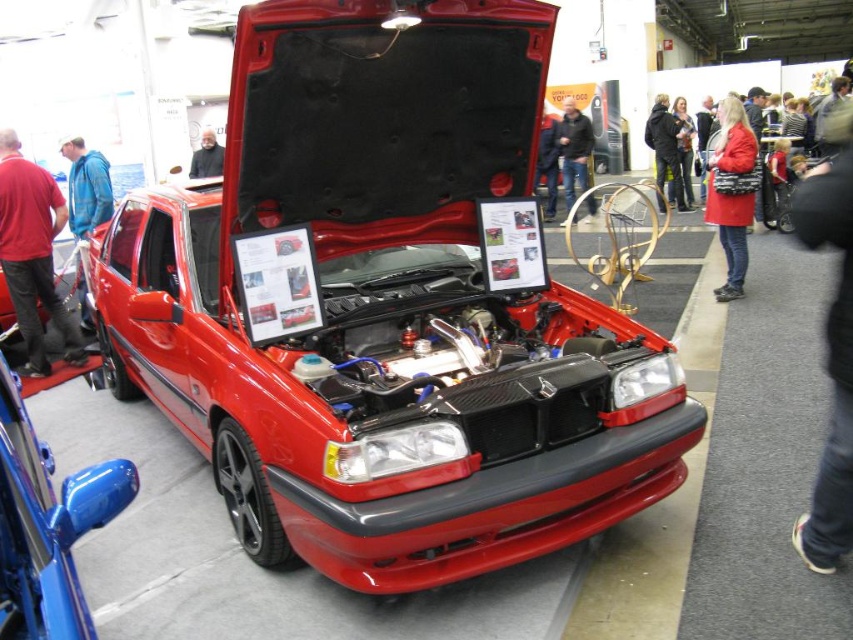
Question: Which object is closer to the camera taking this photo?

Choices:
 (A) dark blue leather jacket at center
 (B) black leather jacket at upper center
 (C) glossy blue side mirror at lower left
 (D) blue fabric jacket at left

Answer: (C)

Question: Estimate the real-world distances between objects in this image. Which object is farther from the blue fabric jacket at left?

Choices:
 (A) black leather jacket at upper center
 (B) matte red coat at right
 (C) shiny red car at center
 (D) blonde hair at center

Answer: (D)

Question: Is shiny red car at center behind blonde hair at center?

Choices:
 (A) no
 (B) yes

Answer: (A)

Question: Is shiny red car at center further to camera compared to blonde hair at center?

Choices:
 (A) yes
 (B) no

Answer: (B)

Question: Which is nearer to the smooth black jacket at center?

Choices:
 (A) black leather jacket at upper center
 (B) red fabric jacket at left

Answer: (B)

Question: Can you confirm if shiny red car at center is positioned below dark blue leather jacket at center?

Choices:
 (A) yes
 (B) no

Answer: (A)